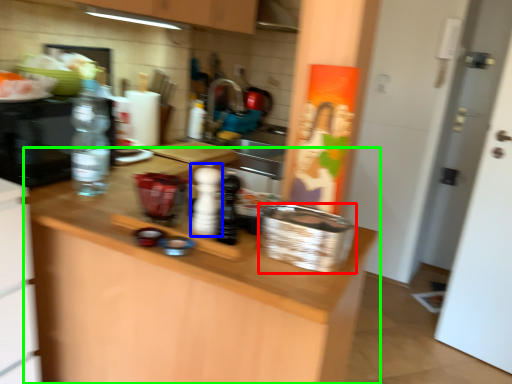
Question: Which is nearer to the basket (highlighted by a red box)? bottle (highlighted by a blue box) or countertop (highlighted by a green box).

Choices:
 (A) bottle
 (B) countertop

Answer: (A)